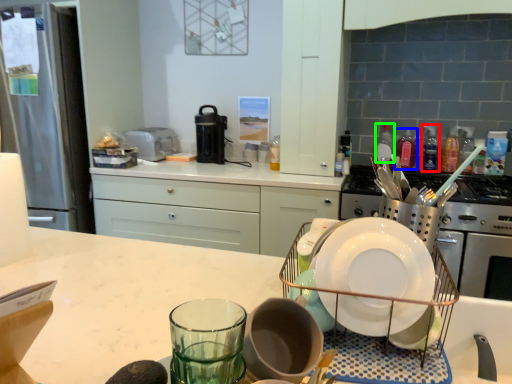
Question: Which is farther away from bottle (highlighted by a red box)? bottle (highlighted by a blue box) or bottle (highlighted by a green box)?

Choices:
 (A) bottle
 (B) bottle

Answer: (B)